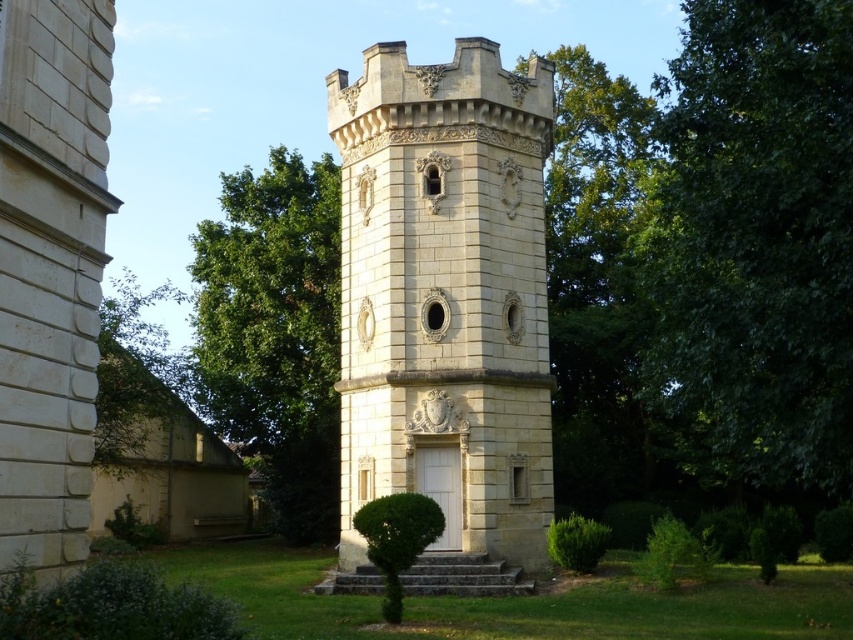
From the picture: You are standing in a garden with a stone tower nearby. You see a point marked at coordinates (445,310). What does this point represent?

The point at (445,310) corresponds to the white stone tower at center.

You are standing in front of a white stone tower at center and a green leafy tree at center. Which one has a smaller width?

The white stone tower at center is thinner than the green leafy tree at center, so the white stone tower at center has a smaller width.

You are standing in front of the white stone tower at center and the green leafy tree at center. Which object is nearer to you?

The white stone tower at center is closer to the viewer than the green leafy tree at center.